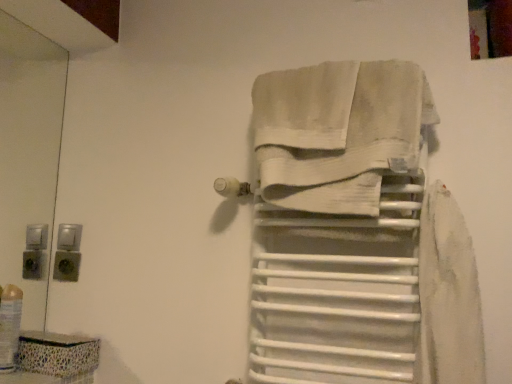
Question: Should I look upward or downward to see white cotton towel at center?

Choices:
 (A) down
 (B) up

Answer: (B)

Question: Is white cotton towel at center bigger than translucent plastic bottle at lower left?

Choices:
 (A) yes
 (B) no

Answer: (A)

Question: From a real-world perspective, does white cotton towel at center sit lower than translucent plastic bottle at lower left?

Choices:
 (A) yes
 (B) no

Answer: (B)

Question: Is white cotton towel at center placed right next to translucent plastic bottle at lower left?

Choices:
 (A) yes
 (B) no

Answer: (B)

Question: Is white cotton towel at center facing towards translucent plastic bottle at lower left?

Choices:
 (A) yes
 (B) no

Answer: (B)

Question: Is white cotton towel at center looking in the opposite direction of translucent plastic bottle at lower left?

Choices:
 (A) no
 (B) yes

Answer: (A)

Question: Is white cotton towel at center smaller than translucent plastic bottle at lower left?

Choices:
 (A) yes
 (B) no

Answer: (B)

Question: Is white matte towel rack at center completely or partially outside of translucent plastic bottle at lower left?

Choices:
 (A) no
 (B) yes

Answer: (B)

Question: Is white matte towel rack at center facing away from translucent plastic bottle at lower left?

Choices:
 (A) yes
 (B) no

Answer: (B)

Question: From a real-world perspective, does white matte towel rack at center sit lower than translucent plastic bottle at lower left?

Choices:
 (A) yes
 (B) no

Answer: (B)

Question: Is the position of white matte towel rack at center more distant than that of translucent plastic bottle at lower left?

Choices:
 (A) yes
 (B) no

Answer: (B)

Question: From the image's perspective, is white matte towel rack at center under translucent plastic bottle at lower left?

Choices:
 (A) yes
 (B) no

Answer: (B)

Question: From a real-world perspective, is white matte towel rack at center positioned over translucent plastic bottle at lower left based on gravity?

Choices:
 (A) yes
 (B) no

Answer: (A)

Question: From the image's perspective, is translucent plastic bottle at lower left located above white matte towel rack at center?

Choices:
 (A) yes
 (B) no

Answer: (B)